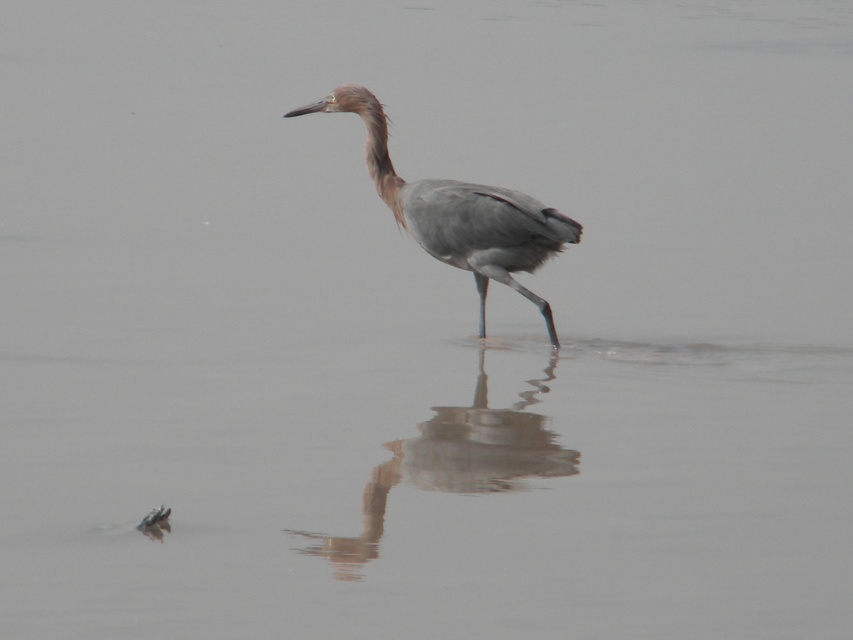
You are a wildlife photographer observing the scene. You notice the gray matte heron at center and its reflection, the smooth gray heron reflection at center. Which one appears larger in the image?

The smooth gray heron reflection at center appears larger than the gray matte heron at center.

You are a nature photographer observing the scene. You notice the gray matte heron at center and its reflection, the smooth gray heron reflection at center. Which one is above the other?

The gray matte heron at center is positioned over the smooth gray heron reflection at center, so the heron is above its reflection.